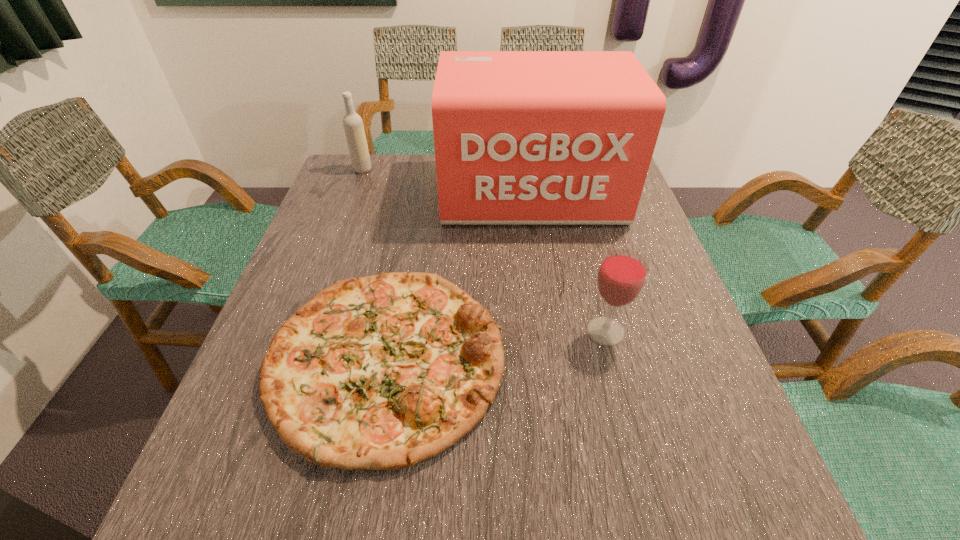
The width and height of the screenshot is (960, 540). Identify the location of object positioned at the near edge. (382, 372).

This screenshot has width=960, height=540. I want to click on vodka situated at the left edge, so point(354,130).

Locate an element on the screen. This screenshot has height=540, width=960. pizza that is positioned at the left edge is located at coordinates (382, 372).

At what (x,y) coordinates should I click in order to perform the action: click on box situated at the right edge. Please return your answer as a coordinate pair (x, y). This screenshot has height=540, width=960. Looking at the image, I should click on (521, 137).

The width and height of the screenshot is (960, 540). I want to click on wineglass at the right edge, so click(x=622, y=274).

Identify the location of object at the far left corner. This screenshot has width=960, height=540. (354, 130).

Locate an element on the screen. This screenshot has height=540, width=960. object that is positioned at the near left corner is located at coordinates (382, 372).

You are a GUI agent. You are given a task and a screenshot of the screen. Output one action in this format:
    pyautogui.click(x=<x>, y=<y>)
    Task: Click on the object situated at the far right corner
    The height and width of the screenshot is (540, 960).
    Given the screenshot: What is the action you would take?
    pyautogui.click(x=521, y=137)

Find the location of a particular element. The width and height of the screenshot is (960, 540). vacant region at the near edge of the desktop is located at coordinates (429, 475).

Find the location of a particular element. This screenshot has height=540, width=960. free space at the left edge of the desktop is located at coordinates (348, 232).